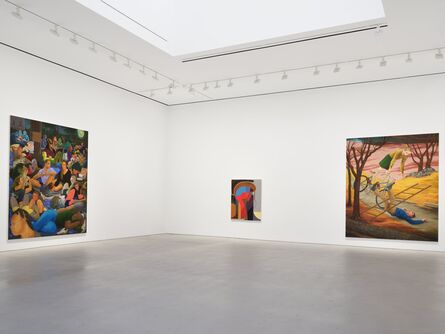
Identify the location of small painting. (249, 199).